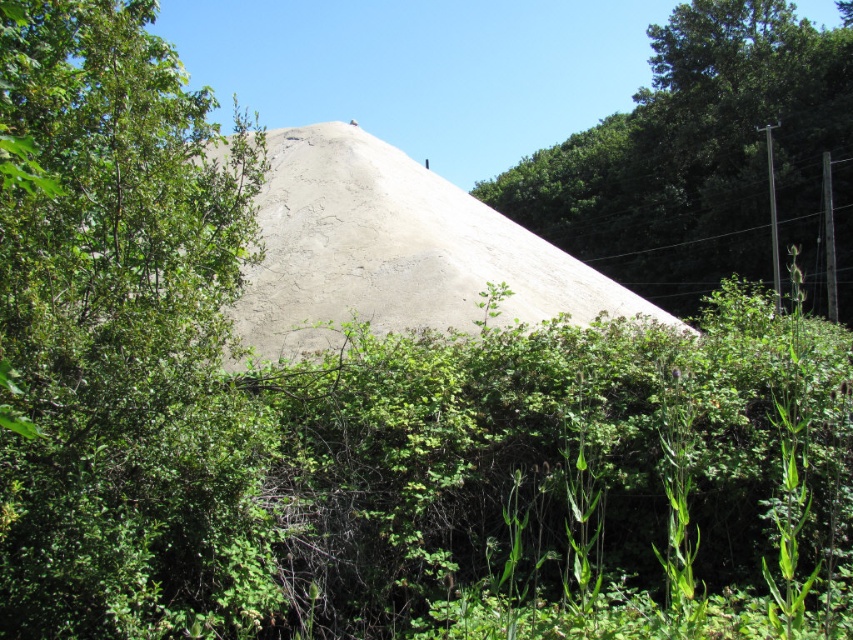
Question: Which point is closer to the camera?

Choices:
 (A) green leafy tree at upper right
 (B) smooth concrete hillside at center
 (C) green leafy tree at upper left

Answer: (C)

Question: Which point appears farthest from the camera in this image?

Choices:
 (A) (257, 184)
 (B) (399, 168)
 (C) (813, 60)

Answer: (C)

Question: From the image, what is the correct spatial relationship of green leafy tree at upper right in relation to smooth concrete hillside at center?

Choices:
 (A) right
 (B) left

Answer: (A)

Question: In this image, where is green leafy tree at upper right located relative to smooth concrete hillside at center?

Choices:
 (A) left
 (B) right

Answer: (B)

Question: Is green leafy tree at upper left above green leafy tree at upper right?

Choices:
 (A) yes
 (B) no

Answer: (B)

Question: Which point is farther to the camera?

Choices:
 (A) pos(529,284)
 (B) pos(165,401)
 (C) pos(778,218)

Answer: (C)